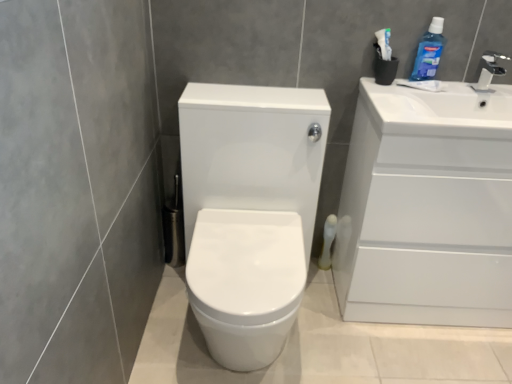
This screenshot has width=512, height=384. What do you see at coordinates (327, 241) in the screenshot? I see `white matte toilet paper at lower right` at bounding box center [327, 241].

Where is `blue glossy mouthwash at upper right`? Image resolution: width=512 pixels, height=384 pixels. blue glossy mouthwash at upper right is located at coordinates (429, 52).

Where is `white glossy cabinet at right`? This screenshot has width=512, height=384. white glossy cabinet at right is located at coordinates (428, 208).

Are white glossy faucet at upper right and white matte toilet paper at lower right beside each other?

There is a gap between white glossy faucet at upper right and white matte toilet paper at lower right.

Is white glossy faucet at upper right positioned with its back to white matte toilet paper at lower right?

No, white matte toilet paper at lower right is not at the back of white glossy faucet at upper right.

Considering the positions of objects white glossy faucet at upper right and white matte toilet paper at lower right in the image provided, who is more to the left, white glossy faucet at upper right or white matte toilet paper at lower right?

From the viewer's perspective, white matte toilet paper at lower right appears more on the left side.

Considering the relative sizes of white glossy cabinet at right and white glossy faucet at upper right in the image provided, is white glossy cabinet at right taller than white glossy faucet at upper right?

Yes.

Is point (473, 319) farther from viewer compared to point (501, 72)?

Yes, point (473, 319) is farther from viewer.

Are white glossy cabinet at right and white glossy faucet at upper right beside each other?

There is a gap between white glossy cabinet at right and white glossy faucet at upper right.

Is white matte toilet paper at lower right closer to the viewer compared to blue glossy mouthwash at upper right?

That is False.

From a real-world perspective, is white matte toilet paper at lower right on top of blue glossy mouthwash at upper right?

Actually, white matte toilet paper at lower right is physically below blue glossy mouthwash at upper right in the real world.

Does white matte toilet paper at lower right have a greater height compared to blue glossy mouthwash at upper right?

Yes.

Is white glossy toilet at center far from white matte toilet paper at lower right?

white glossy toilet at center is near white matte toilet paper at lower right, not far away.

The height and width of the screenshot is (384, 512). Find the location of `porcelain located above the white matte toilet paper at lower right (from a real-world perspective)`. porcelain located above the white matte toilet paper at lower right (from a real-world perspective) is located at coordinates (249, 211).

Can you confirm if white glossy toilet at center is wider than white matte toilet paper at lower right?

Yes, white glossy toilet at center is wider than white matte toilet paper at lower right.

Between white glossy toilet at center and white matte toilet paper at lower right, which one has larger size?

white glossy toilet at center.

From the image's perspective, is blue glossy mouthwash at upper right above or below white glossy cabinet at right?

blue glossy mouthwash at upper right is above white glossy cabinet at right.

Which is behind, point (434, 39) or point (357, 257)?

The point (357, 257) is farther from the camera.

Based on the photo, is blue glossy mouthwash at upper right looking in the opposite direction of white glossy cabinet at right?

No, blue glossy mouthwash at upper right is not facing away from white glossy cabinet at right.

Considering the positions of objects white glossy cabinet at right and blue glossy mouthwash at upper right in the image provided, who is more to the right, white glossy cabinet at right or blue glossy mouthwash at upper right?

white glossy cabinet at right is more to the right.

Is white glossy cabinet at right inside or outside of blue glossy mouthwash at upper right?

white glossy cabinet at right is located beyond the bounds of blue glossy mouthwash at upper right.

Would you say white glossy cabinet at right is a long distance from blue glossy mouthwash at upper right?

That's not correct — white glossy cabinet at right is a little close to blue glossy mouthwash at upper right.

Could you tell me if white glossy cabinet at right is turned towards blue glossy mouthwash at upper right?

No, white glossy cabinet at right does not turn towards blue glossy mouthwash at upper right.

Choose the correct answer: Is white matte toilet paper at lower right inside white glossy toilet at center or outside it?

white matte toilet paper at lower right lies outside white glossy toilet at center.

Is white matte toilet paper at lower right positioned far away from white glossy toilet at center?

white matte toilet paper at lower right is near white glossy toilet at center, not far away.

How distant is white matte toilet paper at lower right from white glossy toilet at center?

58.44 centimeters.

The width and height of the screenshot is (512, 384). I want to click on toilet paper that appears behind the white glossy faucet at upper right, so click(327, 241).

Find the location of a particular element. The width and height of the screenshot is (512, 384). bathroom cabinet below the white glossy faucet at upper right (from a real-world perspective) is located at coordinates (428, 208).

In the scene shown: From the image, which object appears to be nearer to white glossy faucet at upper right, blue glossy mouthwash at upper right or white glossy cabinet at right?

blue glossy mouthwash at upper right lies closer to white glossy faucet at upper right than the other object.

When comparing their distances from white matte toilet paper at lower right, does white glossy cabinet at right or blue glossy mouthwash at upper right seem closer?

Based on the image, white glossy cabinet at right appears to be nearer to white matte toilet paper at lower right.

When comparing their distances from white glossy faucet at upper right, does white glossy cabinet at right or white glossy toilet at center seem closer?

Among the two, white glossy cabinet at right is located nearer to white glossy faucet at upper right.

From the image, which object appears to be nearer to white glossy faucet at upper right, white matte toilet paper at lower right or white glossy cabinet at right?

Based on the image, white glossy cabinet at right appears to be nearer to white glossy faucet at upper right.

Which object lies further to the anchor point blue glossy mouthwash at upper right, white matte toilet paper at lower right or white glossy toilet at center?

white glossy toilet at center.

When comparing their distances from white glossy toilet at center, does white glossy faucet at upper right or white glossy cabinet at right seem closer?

Among the two, white glossy cabinet at right is located nearer to white glossy toilet at center.

When comparing their distances from white glossy cabinet at right, does blue glossy mouthwash at upper right or white matte toilet paper at lower right seem further?

Based on the image, white matte toilet paper at lower right appears to be further to white glossy cabinet at right.

When comparing their distances from white matte toilet paper at lower right, does white glossy toilet at center or white glossy cabinet at right seem further?

Among the two, white glossy toilet at center is located further to white matte toilet paper at lower right.

Locate an element on the screen. This screenshot has height=384, width=512. bathroom cabinet situated between white glossy toilet at center and white glossy faucet at upper right from left to right is located at coordinates (428, 208).

At what (x,y) coordinates should I click in order to perform the action: click on bathroom cabinet between white glossy faucet at upper right and white matte toilet paper at lower right in the vertical direction. Please return your answer as a coordinate pair (x, y). The width and height of the screenshot is (512, 384). Looking at the image, I should click on (428, 208).

The height and width of the screenshot is (384, 512). I want to click on cleaning product between white glossy toilet at center and white glossy cabinet at right from left to right, so click(x=429, y=52).

Identify the location of tap between white glossy toilet at center and white matte toilet paper at lower right along the z-axis. (489, 71).